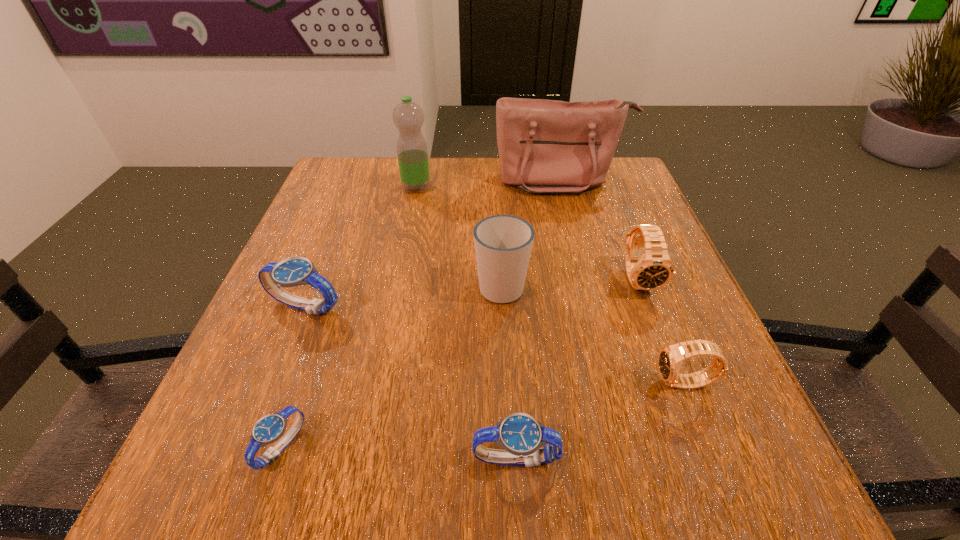
The width and height of the screenshot is (960, 540). In order to click on free space located 0.300m on the face of the sixth farthest object in this screenshot , I will do `click(468, 383)`.

Locate an element on the screen. This screenshot has height=540, width=960. vacant position located 0.100m on the face of the sixth farthest object is located at coordinates (594, 383).

Find the location of a particular element. This screenshot has width=960, height=540. vacant space located on the face of the sixth farthest object is located at coordinates (418, 383).

Image resolution: width=960 pixels, height=540 pixels. I want to click on free space located on the back of the third watch from right to left, so click(x=506, y=299).

The width and height of the screenshot is (960, 540). I want to click on free space located 0.230m on the back of the smallest blue watch, so click(329, 307).

Identify the location of water bottle at the far edge. This screenshot has width=960, height=540. (408, 117).

This screenshot has width=960, height=540. Find the location of `shoulder bag located at the far edge`. shoulder bag located at the far edge is located at coordinates (545, 146).

Locate an element on the screen. The width and height of the screenshot is (960, 540). shoulder bag that is at the right edge is located at coordinates (545, 146).

The image size is (960, 540). I want to click on object that is positioned at the near left corner, so click(x=270, y=428).

The height and width of the screenshot is (540, 960). I want to click on object positioned at the far right corner, so click(x=545, y=146).